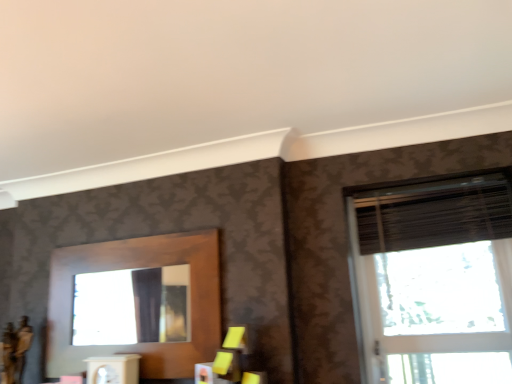
Question: Considering the positions of black textured blind at upper right and matte black window at right in the image, is black textured blind at upper right wider or thinner than matte black window at right?

Choices:
 (A) thin
 (B) wide

Answer: (B)

Question: Considering their positions, is black textured blind at upper right located in front of or behind matte black window at right?

Choices:
 (A) behind
 (B) front

Answer: (A)

Question: Looking at the image, does black textured blind at upper right seem bigger or smaller compared to matte black window at right?

Choices:
 (A) big
 (B) small

Answer: (B)

Question: Looking at their shapes, would you say matte black window at right is wider or thinner than black textured blind at upper right?

Choices:
 (A) wide
 (B) thin

Answer: (B)

Question: Is point click(412, 200) closer or farther from the camera than point click(440, 211)?

Choices:
 (A) farther
 (B) closer

Answer: (A)

Question: Relative to black textured blind at upper right, is matte black window at right in front or behind?

Choices:
 (A) behind
 (B) front

Answer: (B)

Question: Is matte black window at right taller or shorter than black textured blind at upper right?

Choices:
 (A) tall
 (B) short

Answer: (A)